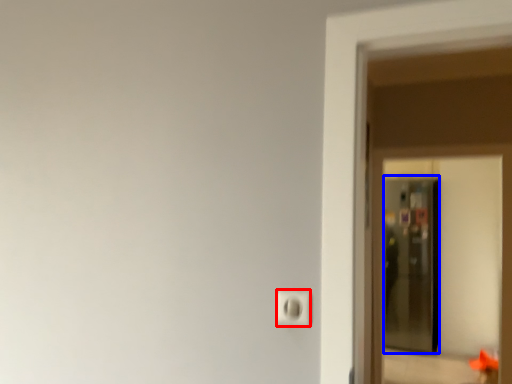
Question: Which object is closer to the camera taking this photo, light switch (highlighted by a red box) or screen door (highlighted by a blue box)?

Choices:
 (A) light switch
 (B) screen door

Answer: (A)